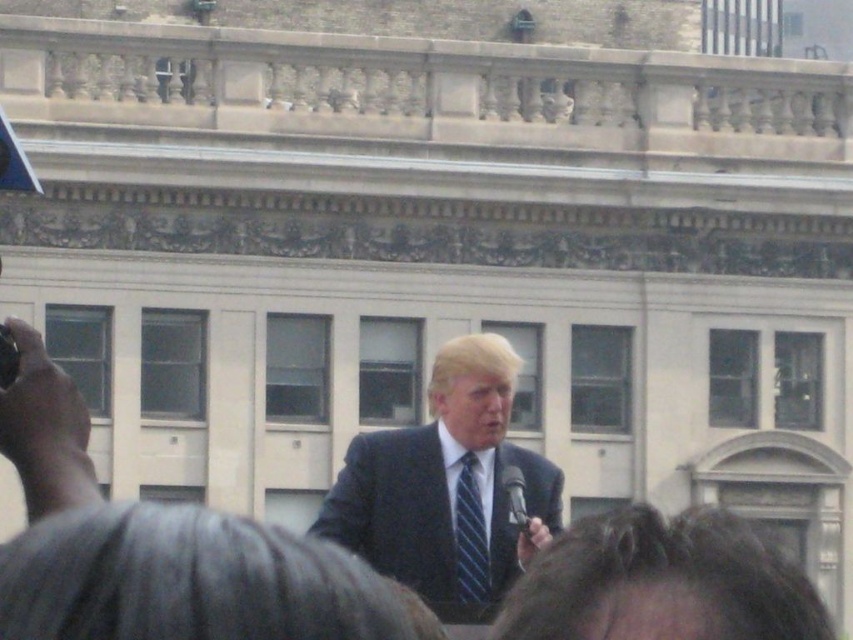
Question: Where is dark blue suit at center located in relation to black plastic microphone at lower center in the image?

Choices:
 (A) below
 (B) above

Answer: (B)

Question: Which object appears closest to the camera in this image?

Choices:
 (A) dark blue suit at center
 (B) blue striped tie at center

Answer: (A)

Question: Observing the image, what is the correct spatial positioning of dark blue suit at center in reference to blue striped tie at center?

Choices:
 (A) below
 (B) above

Answer: (B)

Question: Which object appears closest to the camera in this image?

Choices:
 (A) dark blue suit at center
 (B) blue striped tie at center

Answer: (A)

Question: Which of these objects is positioned farthest from the dark blue suit at center?

Choices:
 (A) blue striped tie at center
 (B) black plastic microphone at lower center

Answer: (B)

Question: Is blue striped tie at center positioned before black plastic microphone at lower center?

Choices:
 (A) no
 (B) yes

Answer: (A)